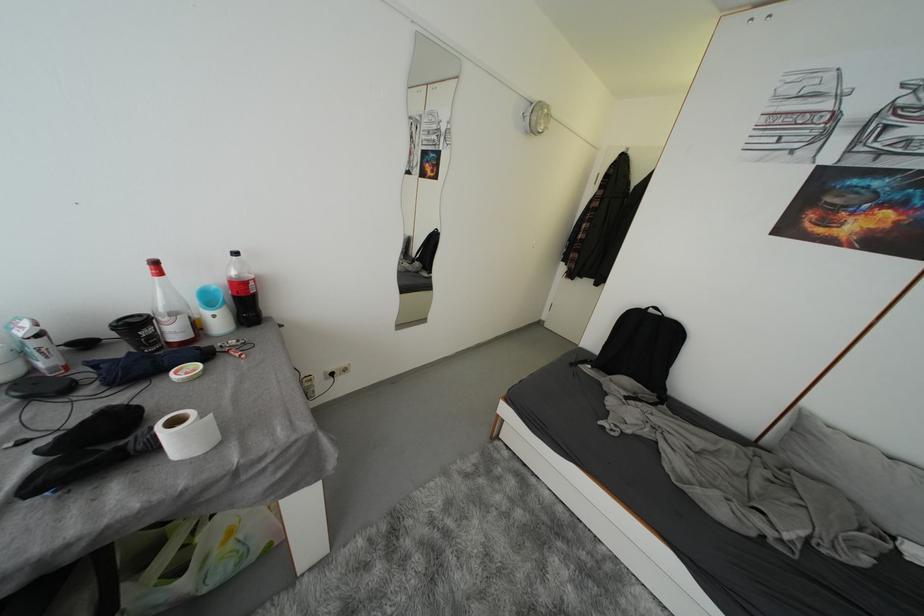
You are a GUI agent. You are given a task and a screenshot of the screen. Output one action in this format:
    pyautogui.click(x=<x>, y=<y>)
    Task: Click on the blue personal humidifier
    The height and width of the screenshot is (616, 924).
    Given the screenshot: What is the action you would take?
    pyautogui.click(x=214, y=310)